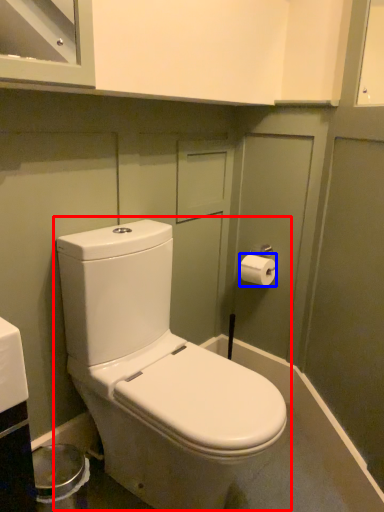
Question: Which point is further to the camera, toilet (highlighted by a red box) or toilet paper (highlighted by a blue box)?

Choices:
 (A) toilet
 (B) toilet paper

Answer: (B)